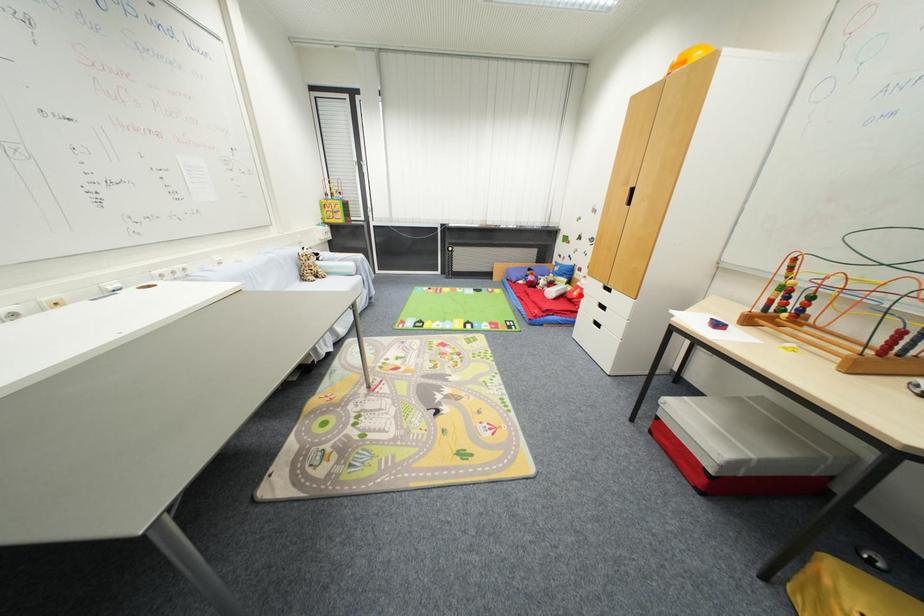
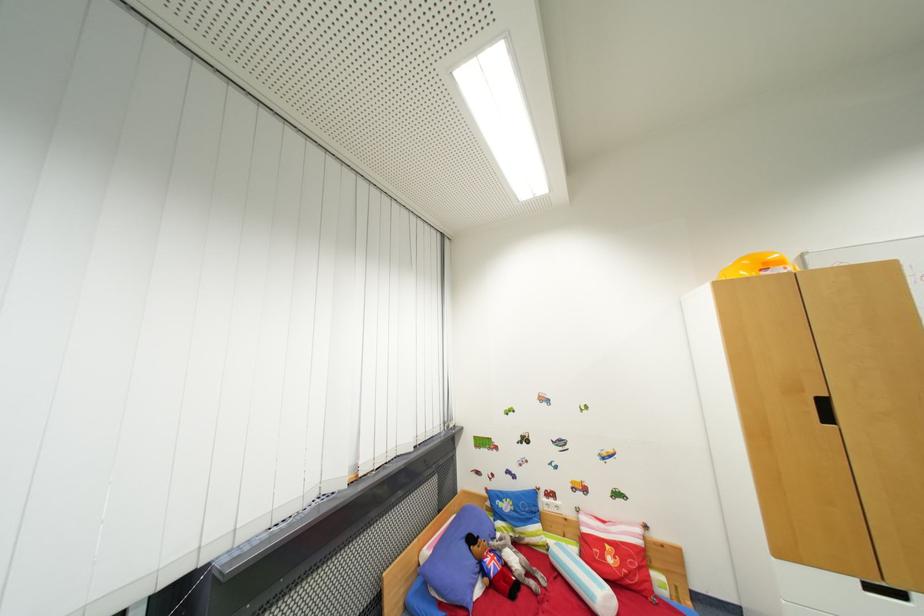
The point at the highlighted location is marked in the first image. Where is the corresponding point in the second image?

(614, 562)